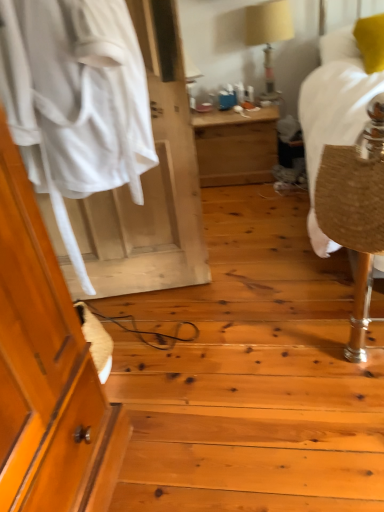
Question: Is wooden desk at center inside white fabric at left?

Choices:
 (A) no
 (B) yes

Answer: (A)

Question: Considering the relative sizes of white fabric at left and wooden desk at center in the image provided, is white fabric at left taller than wooden desk at center?

Choices:
 (A) no
 (B) yes

Answer: (B)

Question: Is white fabric at left at the right side of wooden desk at center?

Choices:
 (A) yes
 (B) no

Answer: (B)

Question: Does white fabric at left have a smaller size compared to wooden desk at center?

Choices:
 (A) no
 (B) yes

Answer: (A)

Question: From a real-world perspective, is white fabric at left located higher than wooden desk at center?

Choices:
 (A) yes
 (B) no

Answer: (A)

Question: Is point (382, 61) positioned closer to the camera than point (183, 172)?

Choices:
 (A) farther
 (B) closer

Answer: (A)

Question: Considering the positions of yellow fabric pillow at upper right and white fabric at left in the image, is yellow fabric pillow at upper right bigger or smaller than white fabric at left?

Choices:
 (A) big
 (B) small

Answer: (B)

Question: Considering the positions of yellow fabric pillow at upper right and white fabric at left in the image, is yellow fabric pillow at upper right taller or shorter than white fabric at left?

Choices:
 (A) short
 (B) tall

Answer: (A)

Question: From a real-world perspective, relative to white fabric at left, is yellow fabric pillow at upper right vertically above or below?

Choices:
 (A) above
 (B) below

Answer: (A)

Question: Would you say beige fabric lampshade at upper center is inside or outside wooden desk at center?

Choices:
 (A) inside
 (B) outside

Answer: (B)

Question: In the image, is beige fabric lampshade at upper center on the left side or the right side of wooden desk at center?

Choices:
 (A) left
 (B) right

Answer: (B)

Question: Looking at the image, does beige fabric lampshade at upper center seem bigger or smaller compared to wooden desk at center?

Choices:
 (A) small
 (B) big

Answer: (A)

Question: Does point (258, 30) appear closer or farther from the camera than point (269, 110)?

Choices:
 (A) closer
 (B) farther

Answer: (A)

Question: From the image's perspective, relative to beige fabric lampshade at upper center, is burlap-like fabric at right above or below?

Choices:
 (A) below
 (B) above

Answer: (A)

Question: Is burlap-like fabric at right wider or thinner than beige fabric lampshade at upper center?

Choices:
 (A) thin
 (B) wide

Answer: (A)